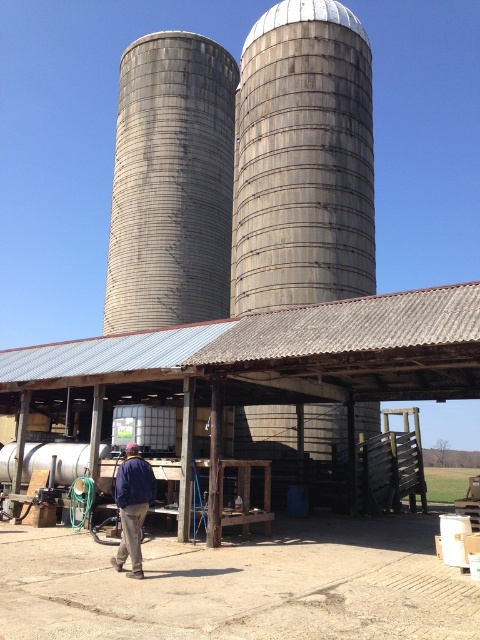
You are standing in front of the farm scene. There are two points marked in the image. The first point is at coordinates point [239,324] and the second is at point [171,266]. Which point is closer to you?

Point [239,324] is closer to the camera than point [171,266].